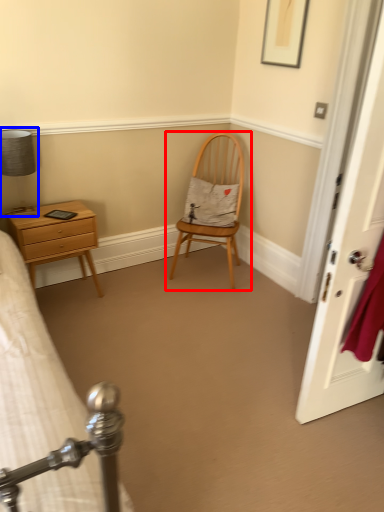
Question: Which of the following is the farthest to the observer, chair (highlighted by a red box) or bedside lamp (highlighted by a blue box)?

Choices:
 (A) chair
 (B) bedside lamp

Answer: (A)